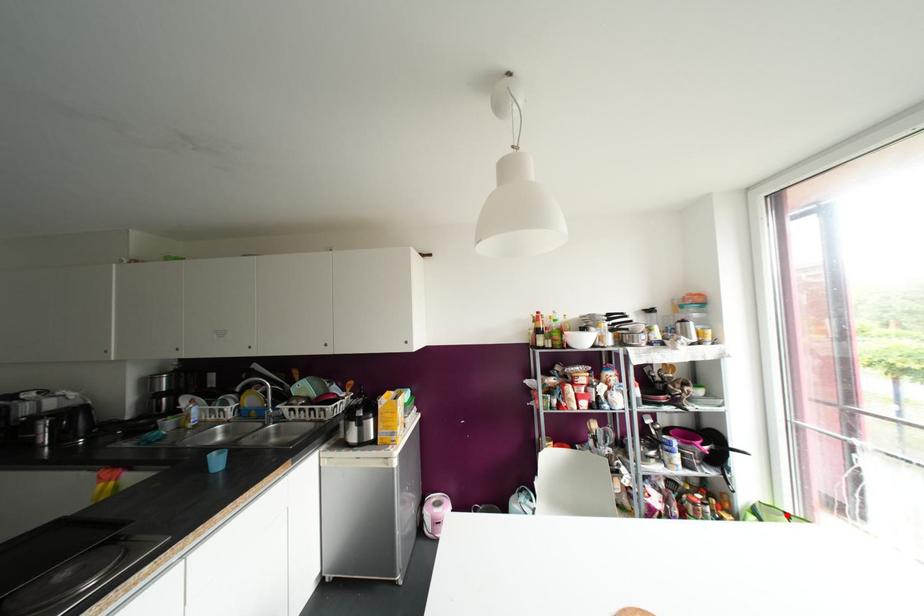
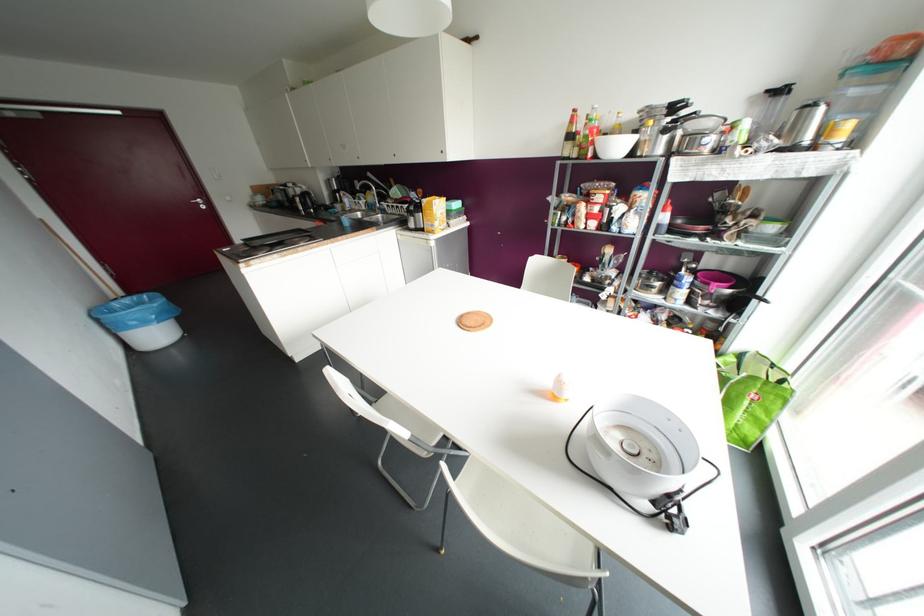
Locate, in the second image, the point that corresponds to the highlighted location in the first image.

(772, 365)